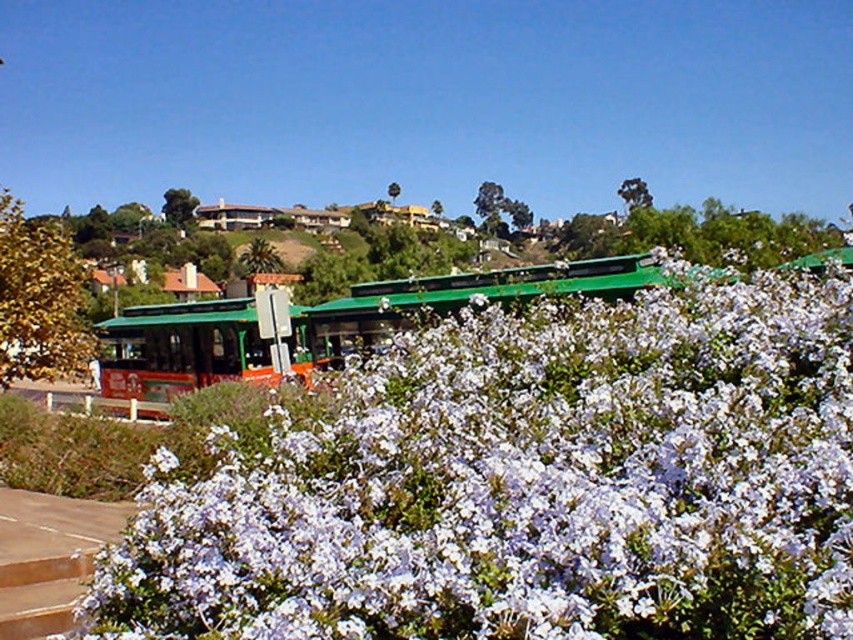
Question: Which point is closer to the camera?

Choices:
 (A) (132, 362)
 (B) (236, 358)
 (C) (308, 467)

Answer: (C)

Question: Estimate the real-world distances between objects in this image. Which object is farther from the green metallic bus stop at center?

Choices:
 (A) white matte flower at center
 (B) green leafy bush at lower left
 (C) yellow-green leafy bush at upper left

Answer: (A)

Question: Can you confirm if green matte bus stop at center is positioned to the left of green leafy bush at lower left?

Choices:
 (A) no
 (B) yes

Answer: (A)

Question: Where is yellow-green leafy bush at upper left located in relation to green leafy bush at lower left in the image?

Choices:
 (A) above
 (B) below

Answer: (A)

Question: Which object is positioned closest to the green leafy bush at lower left?

Choices:
 (A) yellow-green leafy bush at upper left
 (B) green metallic bus stop at center
 (C) white matte flower at center
 (D) green matte bus stop at center

Answer: (A)

Question: Is yellow-green leafy bush at upper left positioned at the back of green leafy bush at lower left?

Choices:
 (A) yes
 (B) no

Answer: (A)